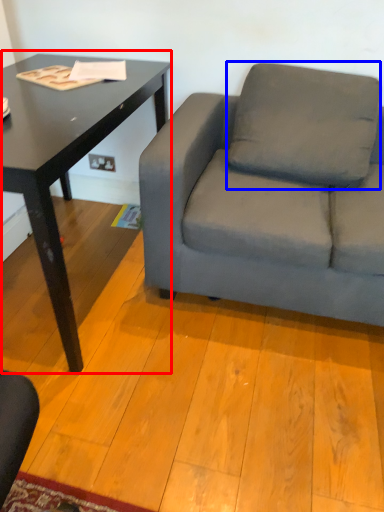
Question: Which object is closer to the camera taking this photo, table (highlighted by a red box) or pillow (highlighted by a blue box)?

Choices:
 (A) table
 (B) pillow

Answer: (A)